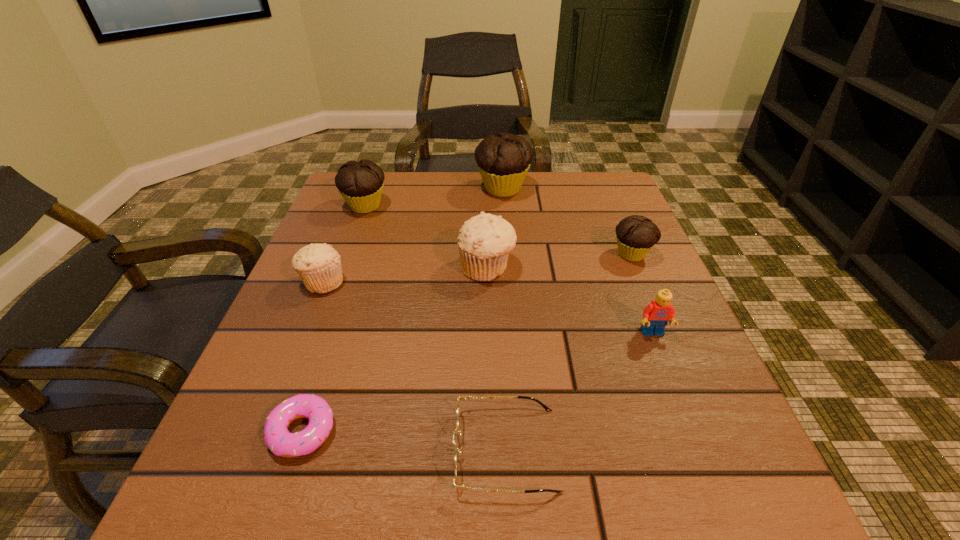
I want to click on the tallest object, so click(503, 160).

Locate an element on the screen. the second chocolate muffin from left to right is located at coordinates (503, 160).

I want to click on the bigger beige muffin, so click(x=484, y=242).

I want to click on the leftmost chocolate muffin, so click(x=360, y=183).

Locate an element on the screen. Lego is located at coordinates (656, 315).

I want to click on the smaller beige muffin, so click(x=319, y=266).

Locate an element on the screen. the rightmost muffin is located at coordinates (636, 235).

Locate an element on the screen. This screenshot has height=540, width=960. the nearest chocolate muffin is located at coordinates (636, 235).

Find the location of `green spectacles`. green spectacles is located at coordinates (465, 398).

The height and width of the screenshot is (540, 960). What are the coordinates of `spectacles` in the screenshot? It's located at (465, 398).